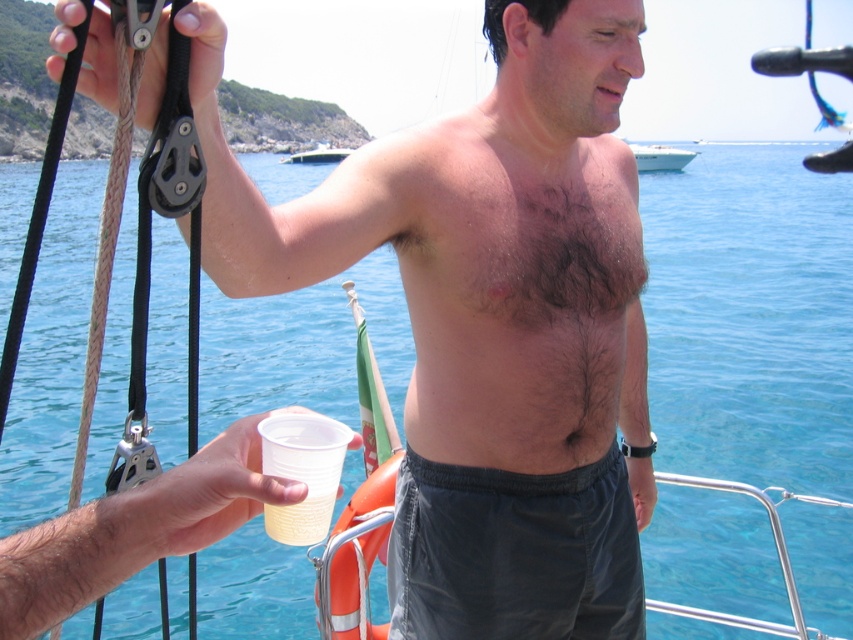
You are a passenger on the boat and want to grab the smooth plastic cup at center to take a sip. Considering the position of the brown hairy chest at center, will you need to move your hand upwards or downwards to reach the cup?

The smooth plastic cup at center is located below the brown hairy chest at center, so you will need to move your hand downwards to reach the cup.

You are a photographer trying to capture a closeup of the brown hairy chest at center. Given that your camera has a focal length of 50mm and you are currently 2 meters away from it, will you be able to fill the frame with just the chest without cropping?

The brown hairy chest at center is located at point coordinates, but without knowing the camera sensor size or the required framing dimensions, it is impossible to determine if the chest will fill the frame at 50mm and 2 meters distance. Additional technical specifications are needed to answer this accurately.

You are a photographer on the boat and want to take a photo of the brown hairy chest at center and the dark gray fabric shorts at lower center. Which object should you focus on first to ensure both are in focus?

The brown hairy chest at center is in front of the dark gray fabric shorts at lower center, so you should focus on the brown hairy chest at center first to ensure both are in focus.